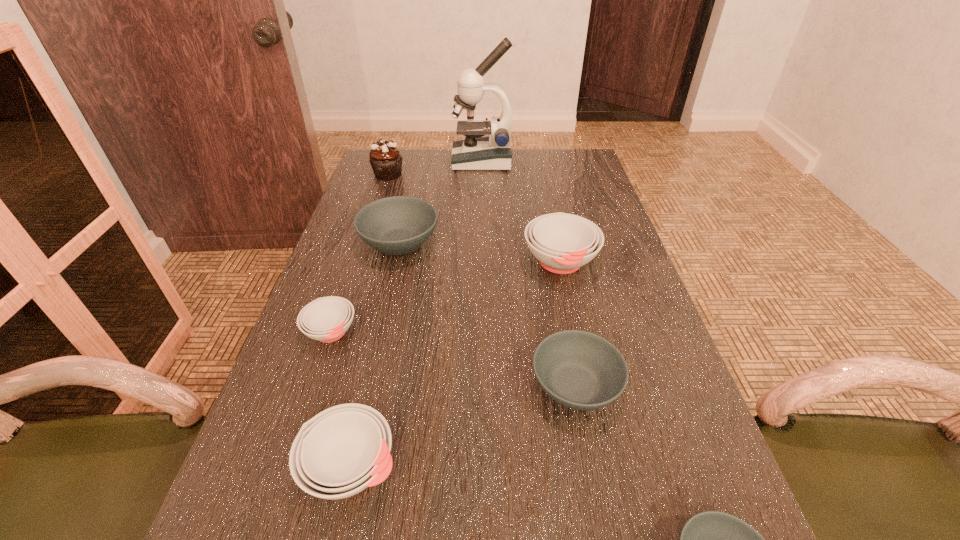
You are a GUI agent. You are given a task and a screenshot of the screen. Output one action in this format:
    pyautogui.click(x=<x>, y=<y>)
    Task: Click on the free space between the leftmost gray soup bowl and the farthest white soup bowl
    The height and width of the screenshot is (540, 960).
    Given the screenshot: What is the action you would take?
    pyautogui.click(x=480, y=253)

Locate an element on the screen. This screenshot has width=960, height=540. object that ranks as the third closest to the nearest white soup bowl is located at coordinates (712, 539).

The width and height of the screenshot is (960, 540). What are the coordinates of `object that is the third closest to the second nearest gray soup bowl` in the screenshot? It's located at (341, 451).

Find the location of a particular element. soup bowl that stands as the fourth closest to the nearest soup bowl is located at coordinates (326, 319).

Find the location of a particular element. Image resolution: width=960 pixels, height=540 pixels. the third closest soup bowl to the second smallest gray soup bowl is located at coordinates (341, 451).

Locate an element on the screen. Image resolution: width=960 pixels, height=540 pixels. the second closest white soup bowl relative to the seventh shortest object is located at coordinates (326, 319).

Select which white soup bowl is the second closest to the second smallest gray soup bowl. Please provide its 2D coordinates. Your answer should be formatted as a tuple, i.e. [(x, y)], where the tuple contains the x and y coordinates of a point satisfying the conditions above.

[(341, 451)]

Identify which gray soup bowl is located as the third nearest to the biggest white soup bowl. Please provide its 2D coordinates. Your answer should be formatted as a tuple, i.e. [(x, y)], where the tuple contains the x and y coordinates of a point satisfying the conditions above.

[(712, 539)]

Identify the location of the closest gray soup bowl to the second biggest gray soup bowl. (712, 539).

At what (x,y) coordinates should I click in order to perform the action: click on vacant space that satisfies the following two spatial constraints: 1. on the front side of the second farthest gray soup bowl; 2. on the left side of the smallest white soup bowl. Please return your answer as a coordinate pair (x, y). Looking at the image, I should click on (312, 386).